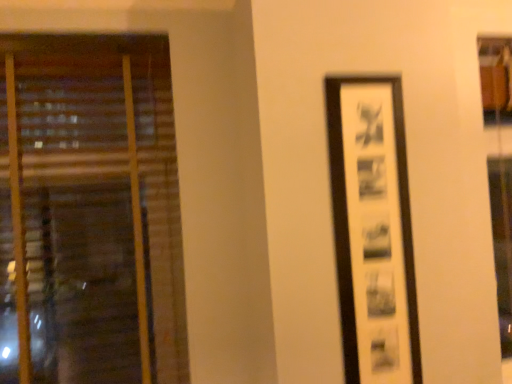
Locate an element on the screen. This screenshot has width=512, height=384. black matte picture frame at right is located at coordinates (373, 230).

What do you see at coordinates (373, 230) in the screenshot? I see `black matte picture frame at right` at bounding box center [373, 230].

Measure the distance between point (330, 83) and camera.

The depth of point (330, 83) is 4.41 feet.

The height and width of the screenshot is (384, 512). What do you see at coordinates (89, 212) in the screenshot? I see `wooden blinds at left` at bounding box center [89, 212].

The image size is (512, 384). I want to click on wooden blinds at left, so click(x=89, y=212).

Measure the distance between point [30,287] and camera.

The depth of point [30,287] is 5.41 feet.

What are the coordinates of `black matte picture frame at right` in the screenshot? It's located at (373, 230).

Is wooden blinds at left to the left of black matte picture frame at right from the viewer's perspective?

Indeed, wooden blinds at left is positioned on the left side of black matte picture frame at right.

Relative to black matte picture frame at right, is wooden blinds at left in front or behind?

Clearly, wooden blinds at left is behind black matte picture frame at right.

Does point (116, 205) appear closer or farther from the camera than point (379, 113)?

Point (116, 205) is positioned farther from the camera compared to point (379, 113).

From the image's perspective, is wooden blinds at left located above black matte picture frame at right?

No.

From a real-world perspective, who is located higher, wooden blinds at left or black matte picture frame at right?

wooden blinds at left is physically above.

Does wooden blinds at left have a greater width compared to black matte picture frame at right?

Yes.

Which of these two, wooden blinds at left or black matte picture frame at right, stands taller?

Standing taller between the two is wooden blinds at left.

Who is bigger, wooden blinds at left or black matte picture frame at right?

Bigger between the two is wooden blinds at left.

Choose the correct answer: Is wooden blinds at left inside black matte picture frame at right or outside it?

wooden blinds at left is outside black matte picture frame at right.

Are wooden blinds at left and black matte picture frame at right far apart?

No, there isn't a large distance between wooden blinds at left and black matte picture frame at right.

Is wooden blinds at left looking in the opposite direction of black matte picture frame at right?

wooden blinds at left is not turned away from black matte picture frame at right.

How distant is wooden blinds at left from black matte picture frame at right?

wooden blinds at left is 32.92 inches away from black matte picture frame at right.

What are the coordinates of `picture frame that is above the wooden blinds at left (from the image's perspective)` in the screenshot? It's located at (373, 230).

Which is more to the left, black matte picture frame at right or wooden blinds at left?

wooden blinds at left.

Does black matte picture frame at right lie behind wooden blinds at left?

No, the depth of black matte picture frame at right is less than that of wooden blinds at left.

Which is closer, (x=416, y=377) or (x=60, y=209)?

The point (x=416, y=377) is in front.

From the image's perspective, which object appears higher, black matte picture frame at right or wooden blinds at left?

black matte picture frame at right, from the image's perspective.

From a real-world perspective, who is located lower, black matte picture frame at right or wooden blinds at left?

From a 3D spatial view, black matte picture frame at right is below.

Can you confirm if black matte picture frame at right is wider than wooden blinds at left?

No.

Can you confirm if black matte picture frame at right is shorter than wooden blinds at left?

Correct, black matte picture frame at right is not as tall as wooden blinds at left.

Based on the photo, between black matte picture frame at right and wooden blinds at left, which one has larger size?

wooden blinds at left is bigger.

Is wooden blinds at left inside black matte picture frame at right?

Definitely not — wooden blinds at left is not inside black matte picture frame at right.

Are black matte picture frame at right and wooden blinds at left beside each other?

They are not placed beside each other.

Is black matte picture frame at right oriented away from wooden blinds at left?

black matte picture frame at right is not turned away from wooden blinds at left.

How far apart are black matte picture frame at right and wooden blinds at left?

32.92 inches.

Where is `window that is on the left side of black matte picture frame at right`? window that is on the left side of black matte picture frame at right is located at coordinates (89, 212).

What are the coordinates of `window that appears below the black matte picture frame at right (from the image's perspective)` in the screenshot? It's located at (89, 212).

Identify the location of picture frame that is in front of the wooden blinds at left. (373, 230).